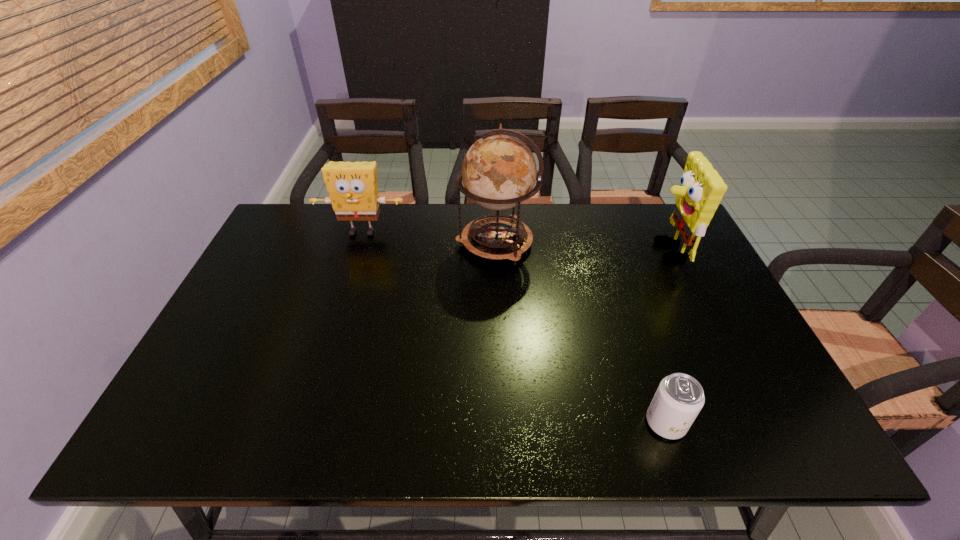
Identify the location of free spot that satisfies the following two spatial constraints: 1. at the center of the nearest object; 2. on the left side of the tallest object. (503, 423).

Image resolution: width=960 pixels, height=540 pixels. What are the coordinates of `blank space that satisfies the following two spatial constraints: 1. on the face of the soda can; 2. on the right side of the second shortest object` in the screenshot? It's located at (300, 423).

At what (x,y) coordinates should I click in order to perform the action: click on free spot that satisfies the following two spatial constraints: 1. at the center of the soda can; 2. on the left side of the globe. Please return your answer as a coordinate pair (x, y). The height and width of the screenshot is (540, 960). Looking at the image, I should click on (503, 423).

Where is `vacant space that satisfies the following two spatial constraints: 1. at the center of the second object from left to right; 2. on the left side of the shortest object`? This screenshot has width=960, height=540. vacant space that satisfies the following two spatial constraints: 1. at the center of the second object from left to right; 2. on the left side of the shortest object is located at coordinates (503, 423).

Locate an element on the screen. Image resolution: width=960 pixels, height=540 pixels. free spot that satisfies the following two spatial constraints: 1. on the face of the soda can; 2. on the right side of the left sponge is located at coordinates (300, 423).